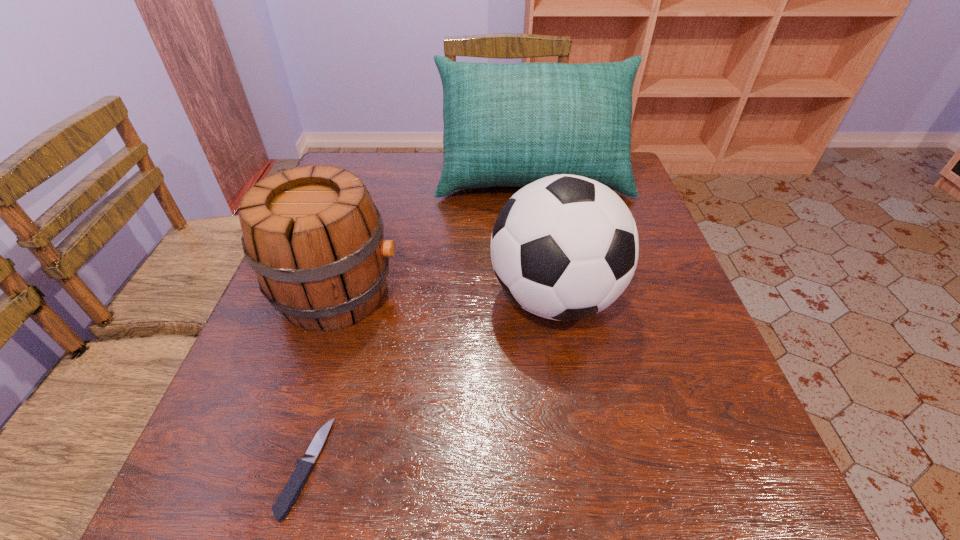
You are a GUI agent. You are given a task and a screenshot of the screen. Output one action in this format:
    pyautogui.click(x=<x>, y=<y>)
    Task: Click on the vacant point located between the cushion and the cider
    This screenshot has height=540, width=960.
    Given the screenshot: What is the action you would take?
    pyautogui.click(x=435, y=235)

Where is `the closest object to the cushion`? The width and height of the screenshot is (960, 540). the closest object to the cushion is located at coordinates (564, 247).

Identify the location of object that stands as the second closest to the cushion. Image resolution: width=960 pixels, height=540 pixels. (313, 236).

At what (x,y) coordinates should I click in order to perform the action: click on free region that satisfies the following two spatial constraints: 1. on the back side of the nearest object; 2. on the side of the cider where the spigot is located. Please return your answer as a coordinate pair (x, y). This screenshot has width=960, height=540. Looking at the image, I should click on (355, 293).

The width and height of the screenshot is (960, 540). Find the location of `blank space that satisfies the following two spatial constraints: 1. on the side of the cider where the spigot is located; 2. on the back side of the shortest object`. blank space that satisfies the following two spatial constraints: 1. on the side of the cider where the spigot is located; 2. on the back side of the shortest object is located at coordinates (282, 467).

I want to click on free location that satisfies the following two spatial constraints: 1. on the front-facing side of the cushion; 2. on the side of the cider where the spigot is located, so click(x=551, y=293).

Where is `vacant region that satisfies the following two spatial constraints: 1. on the front-facing side of the farthest object; 2. on the right side of the soccer ball`? The width and height of the screenshot is (960, 540). vacant region that satisfies the following two spatial constraints: 1. on the front-facing side of the farthest object; 2. on the right side of the soccer ball is located at coordinates (552, 298).

This screenshot has height=540, width=960. What are the coordinates of `vacant space that satisfies the following two spatial constraints: 1. on the side of the cider where the spigot is located; 2. on the back side of the steak knife` in the screenshot? It's located at (282, 467).

At what (x,y) coordinates should I click in order to perform the action: click on blank space that satisfies the following two spatial constraints: 1. on the front-facing side of the farthest object; 2. on the right side of the soccer ball. Please return your answer as a coordinate pair (x, y). Looking at the image, I should click on 552,298.

Find the location of `free space that satisfies the following two spatial constraints: 1. on the side of the shortest object where the spigot is located; 2. on the right side of the cider`. free space that satisfies the following two spatial constraints: 1. on the side of the shortest object where the spigot is located; 2. on the right side of the cider is located at coordinates (282, 467).